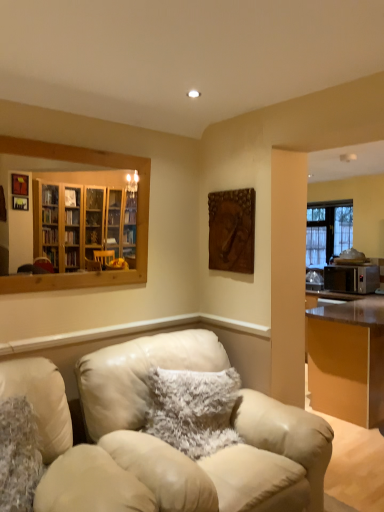
Question: Can you confirm if fuzzy white pillow at center, placed as the 1th pillow when sorted from back to front, is smaller than satin silver microwave at right?

Choices:
 (A) no
 (B) yes

Answer: (B)

Question: Considering the relative sizes of fuzzy white pillow at center, marked as the 2th pillow in a front-to-back arrangement, and satin silver microwave at right in the image provided, is fuzzy white pillow at center, marked as the 2th pillow in a front-to-back arrangement, thinner than satin silver microwave at right?

Choices:
 (A) no
 (B) yes

Answer: (B)

Question: Is fuzzy white pillow at center, placed as the 1th pillow when sorted from back to front, closer to camera compared to satin silver microwave at right?

Choices:
 (A) yes
 (B) no

Answer: (A)

Question: From a real-world perspective, is fuzzy white pillow at center, arranged as the 1th pillow when viewed from the right, physically above satin silver microwave at right?

Choices:
 (A) no
 (B) yes

Answer: (A)

Question: Does fuzzy white pillow at center, arranged as the 1th pillow when viewed from the right, have a lesser height compared to satin silver microwave at right?

Choices:
 (A) yes
 (B) no

Answer: (B)

Question: From the image's perspective, is fuzzy white pillow at center, which is counted as the second pillow, starting from the left, on top of satin silver microwave at right?

Choices:
 (A) no
 (B) yes

Answer: (A)

Question: Does leather chair at center contain fuzzy fabric pillow at lower left, the second pillow positioned from the right?

Choices:
 (A) no
 (B) yes

Answer: (B)

Question: Are leather chair at center and fuzzy fabric pillow at lower left, the second pillow positioned from the right, far apart?

Choices:
 (A) no
 (B) yes

Answer: (A)

Question: Considering the relative positions of leather chair at center and fuzzy fabric pillow at lower left, the second pillow positioned from the right, in the image provided, is leather chair at center behind fuzzy fabric pillow at lower left, the second pillow positioned from the right,?

Choices:
 (A) no
 (B) yes

Answer: (A)

Question: Considering the relative sizes of leather chair at center and fuzzy fabric pillow at lower left, the second pillow positioned from the right, in the image provided, is leather chair at center thinner than fuzzy fabric pillow at lower left, the second pillow positioned from the right,?

Choices:
 (A) yes
 (B) no

Answer: (B)

Question: From a real-world perspective, is leather chair at center physically above fuzzy fabric pillow at lower left, which is the 2th pillow in back-to-front order?

Choices:
 (A) no
 (B) yes

Answer: (A)

Question: Can you confirm if leather chair at center is positioned to the right of fuzzy fabric pillow at lower left, the second pillow positioned from the right?

Choices:
 (A) yes
 (B) no

Answer: (A)

Question: From a real-world perspective, is fuzzy white pillow at center, arranged as the 1th pillow when viewed from the right, located higher than fuzzy fabric pillow at lower left, which is the 2th pillow in back-to-front order?

Choices:
 (A) no
 (B) yes

Answer: (B)